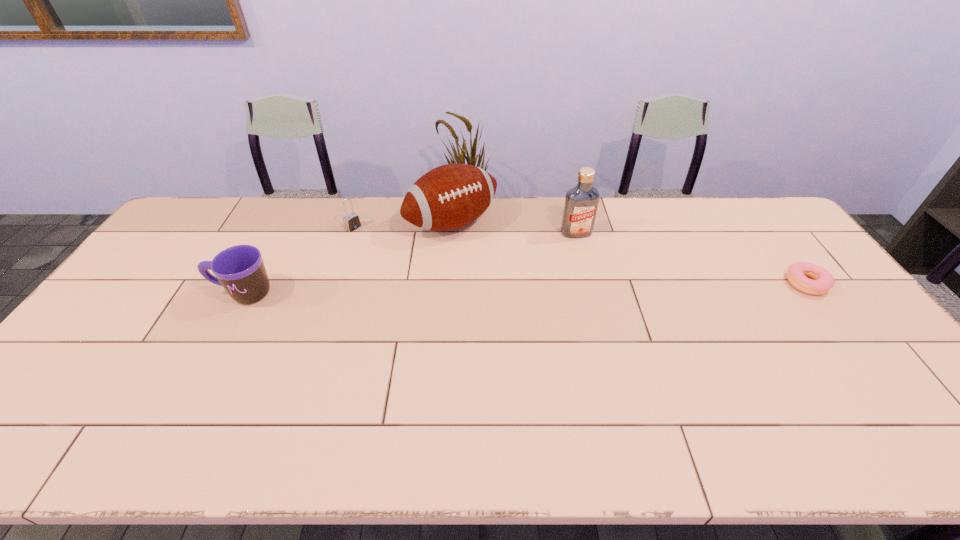
At what (x,y) coordinates should I click in order to perform the action: click on vacant area that lies between the second object from left to right and the third object from right to left. Please return your answer as a coordinate pair (x, y). This screenshot has width=960, height=540. Looking at the image, I should click on (402, 225).

Identify the location of vacant space that is in between the second object from right to left and the leftmost object. (410, 263).

Find the location of `vacant point located between the doughnut and the vodka`. vacant point located between the doughnut and the vodka is located at coordinates (691, 258).

Locate an element on the screen. This screenshot has width=960, height=540. vacant area that lies between the vodka and the rightmost object is located at coordinates point(691,258).

Find the location of `unoccupied area between the vodka and the padlock`. unoccupied area between the vodka and the padlock is located at coordinates tap(465, 230).

Identify the location of vacant area that lies between the vodka and the fourth object from right to left. This screenshot has width=960, height=540. (465, 230).

Where is `vacant point located between the padlock and the rightmost object`? The width and height of the screenshot is (960, 540). vacant point located between the padlock and the rightmost object is located at coordinates (580, 255).

Find the location of a particular element. The image size is (960, 540). vacant space that's between the padlock and the shortest object is located at coordinates (580, 255).

Where is `free space between the fourth object from right to left and the third object from right to left`? The image size is (960, 540). free space between the fourth object from right to left and the third object from right to left is located at coordinates (402, 225).

Locate which object is the second closest to the second object from left to right. Please provide its 2D coordinates. Your answer should be formatted as a tuple, i.e. [(x, y)], where the tuple contains the x and y coordinates of a point satisfying the conditions above.

[(240, 269)]